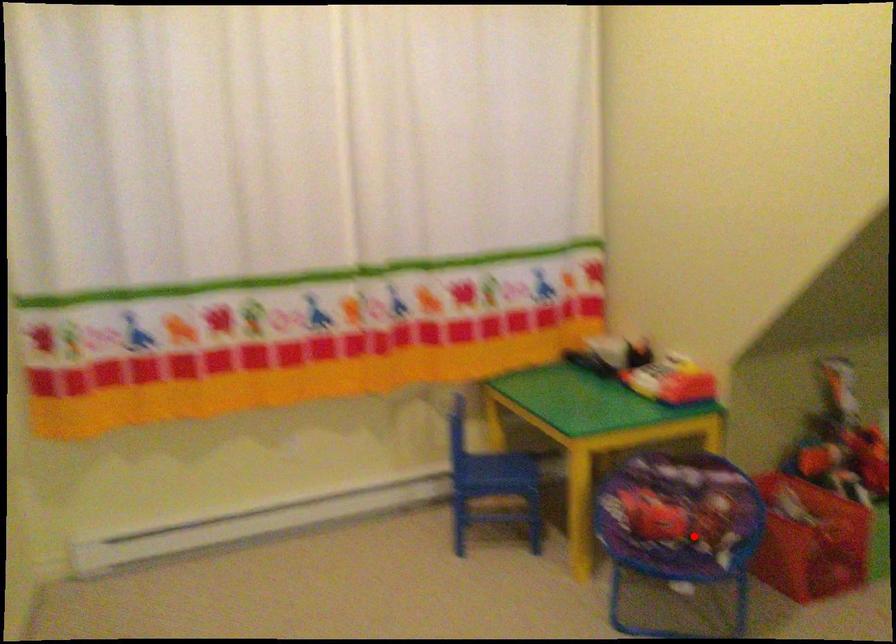
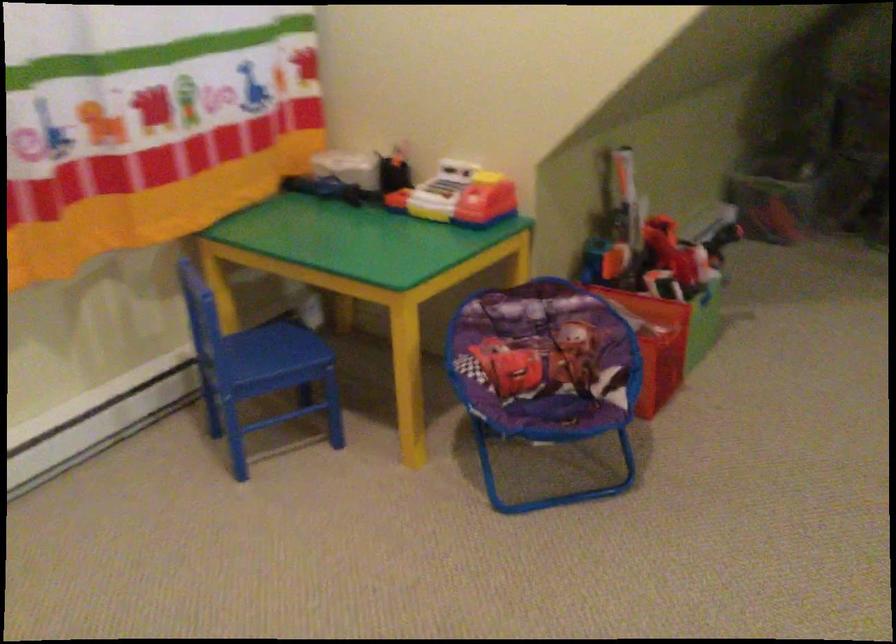
Question: A red point is marked in image1. In image2, is the corresponding 3D point closer to the camera or farther? Reply with the corresponding letter.

Choices:
 (A) The corresponding 3D point is closer.
 (B) The corresponding 3D point is farther.

Answer: (A)